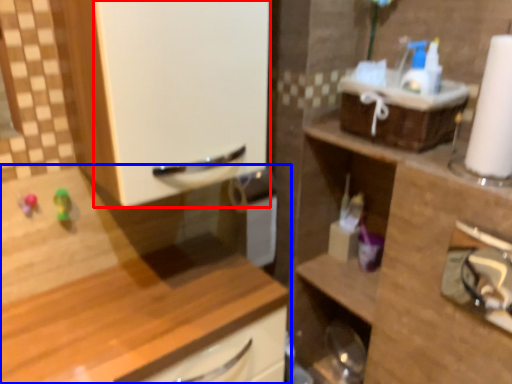
Question: Which object appears closest to the camera in this image, screen door (highlighted by a red box) or cabinetry (highlighted by a blue box)?

Choices:
 (A) screen door
 (B) cabinetry

Answer: (B)